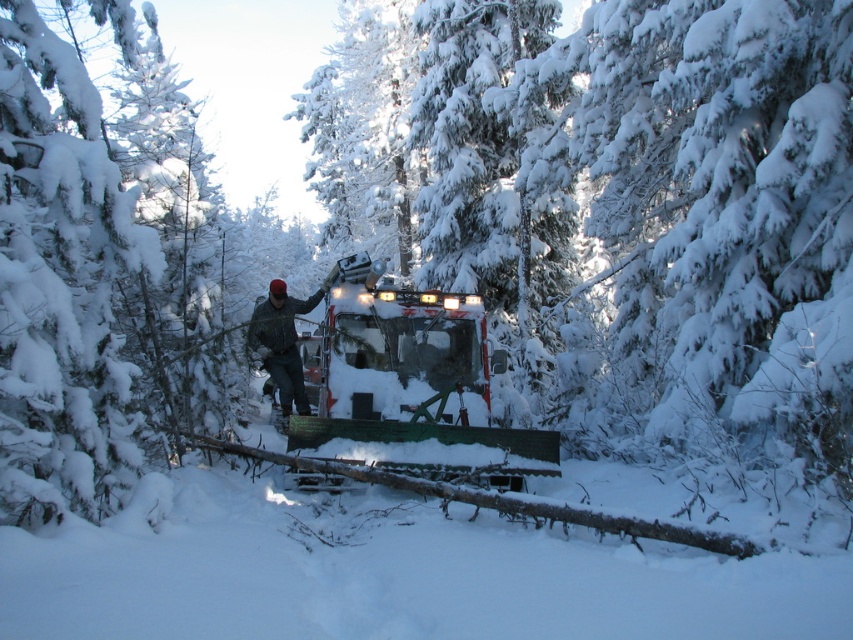
Question: Which point is farther to the camera?

Choices:
 (A) (483, 333)
 (B) (102, 476)
 (C) (305, 413)

Answer: (C)

Question: Where is metallic silver snowmobile at center located in relation to camouflage jacket at center in the image?

Choices:
 (A) right
 (B) left

Answer: (A)

Question: Which object is closer to the camera taking this photo?

Choices:
 (A) camouflage jacket at center
 (B) snow-covered pine tree at left

Answer: (B)

Question: Is metallic silver snowmobile at center bigger than camouflage jacket at center?

Choices:
 (A) no
 (B) yes

Answer: (B)

Question: Estimate the real-world distances between objects in this image. Which object is closer to the camouflage jacket at center?

Choices:
 (A) snow-covered pine tree at left
 (B) metallic silver snowmobile at center

Answer: (B)

Question: Can you confirm if metallic silver snowmobile at center is positioned above camouflage jacket at center?

Choices:
 (A) no
 (B) yes

Answer: (A)